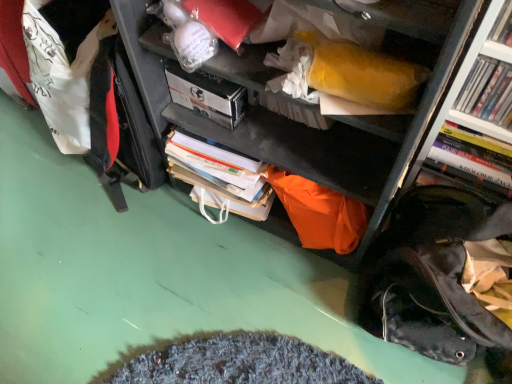
Question: Is white glossy book at upper right, which appears as the 2th book when viewed from the back, positioned in front of hardcover book at right, acting as the 1th book starting from the back?

Choices:
 (A) no
 (B) yes

Answer: (B)

Question: Does white glossy book at upper right, placed as the 2th book when sorted from front to back, have a smaller size compared to hardcover book at right, acting as the 1th book starting from the back?

Choices:
 (A) no
 (B) yes

Answer: (A)

Question: Does white glossy book at upper right, which appears as the 2th book when viewed from the back, have a greater width compared to hardcover book at right, acting as the 1th book starting from the back?

Choices:
 (A) yes
 (B) no

Answer: (B)

Question: Does white glossy book at upper right, placed as the 2th book when sorted from front to back, have a lesser height compared to hardcover book at right, acting as the 1th book starting from the back?

Choices:
 (A) no
 (B) yes

Answer: (A)

Question: Is white glossy book at upper right, which appears as the 2th book when viewed from the back, positioned behind hardcover book at right, the third book positioned from the front?

Choices:
 (A) yes
 (B) no

Answer: (B)

Question: Does hardcover book at upper right, the third book when ordered from back to front, have a greater height compared to white matte paperback book at upper center?

Choices:
 (A) no
 (B) yes

Answer: (B)

Question: Considering the relative positions of hardcover book at upper right, positioned as the first book in front-to-back order, and white matte paperback book at upper center in the image provided, is hardcover book at upper right, positioned as the first book in front-to-back order, in front of white matte paperback book at upper center?

Choices:
 (A) no
 (B) yes

Answer: (B)

Question: Is hardcover book at upper right, the third book when ordered from back to front, looking in the opposite direction of white matte paperback book at upper center?

Choices:
 (A) yes
 (B) no

Answer: (B)

Question: From the image's perspective, does hardcover book at upper right, the third book when ordered from back to front, appear lower than white matte paperback book at upper center?

Choices:
 (A) no
 (B) yes

Answer: (A)

Question: Does hardcover book at upper right, the third book when ordered from back to front, have a lesser width compared to white matte paperback book at upper center?

Choices:
 (A) yes
 (B) no

Answer: (A)

Question: Is hardcover book at upper right, positioned as the first book in front-to-back order, located outside white matte paperback book at upper center?

Choices:
 (A) yes
 (B) no

Answer: (A)

Question: Can we say hardcover book at right, acting as the 1th book starting from the back, lies outside white matte paperback book at upper center?

Choices:
 (A) no
 (B) yes

Answer: (B)